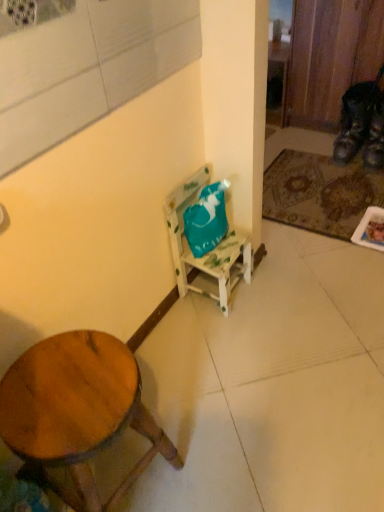
Question: Can you confirm if leather brown shoe at lower right, marked as the second shoe in a right-to-left arrangement, is shorter than brown textured mat at lower right?

Choices:
 (A) yes
 (B) no

Answer: (B)

Question: Is leather brown shoe at lower right, marked as the second shoe in a right-to-left arrangement, directly adjacent to brown textured mat at lower right?

Choices:
 (A) yes
 (B) no

Answer: (B)

Question: Considering the relative sizes of leather brown shoe at lower right, marked as the second shoe in a right-to-left arrangement, and brown textured mat at lower right in the image provided, is leather brown shoe at lower right, marked as the second shoe in a right-to-left arrangement, bigger than brown textured mat at lower right?

Choices:
 (A) yes
 (B) no

Answer: (A)

Question: Can you confirm if leather brown shoe at lower right, marked as the second shoe in a right-to-left arrangement, is positioned to the right of brown textured mat at lower right?

Choices:
 (A) no
 (B) yes

Answer: (B)

Question: Does leather brown shoe at lower right, acting as the 1th shoe starting from the left, turn towards brown textured mat at lower right?

Choices:
 (A) no
 (B) yes

Answer: (B)

Question: From a real-world perspective, does leather brown shoe at lower right, marked as the second shoe in a right-to-left arrangement, sit lower than brown textured mat at lower right?

Choices:
 (A) yes
 (B) no

Answer: (B)

Question: Is leather brown shoe at lower right, marked as the second shoe in a right-to-left arrangement, in front of leather at right, which ranks as the second shoe in left-to-right order?

Choices:
 (A) yes
 (B) no

Answer: (B)

Question: From the image's perspective, does leather brown shoe at lower right, marked as the second shoe in a right-to-left arrangement, appear lower than leather at right, placed as the 1th shoe when sorted from right to left?

Choices:
 (A) yes
 (B) no

Answer: (B)

Question: From a real-world perspective, is leather brown shoe at lower right, acting as the 1th shoe starting from the left, under leather at right, which ranks as the second shoe in left-to-right order?

Choices:
 (A) yes
 (B) no

Answer: (B)

Question: Can you confirm if leather brown shoe at lower right, marked as the second shoe in a right-to-left arrangement, is bigger than leather at right, placed as the 1th shoe when sorted from right to left?

Choices:
 (A) no
 (B) yes

Answer: (B)

Question: From a real-world perspective, is leather brown shoe at lower right, marked as the second shoe in a right-to-left arrangement, on leather at right, placed as the 1th shoe when sorted from right to left?

Choices:
 (A) yes
 (B) no

Answer: (A)

Question: Is leather brown shoe at lower right, acting as the 1th shoe starting from the left, smaller than leather at right, which ranks as the second shoe in left-to-right order?

Choices:
 (A) yes
 (B) no

Answer: (B)

Question: Does leather brown shoe at lower right, marked as the second shoe in a right-to-left arrangement, have a lesser height compared to wooden stool at lower left?

Choices:
 (A) no
 (B) yes

Answer: (B)